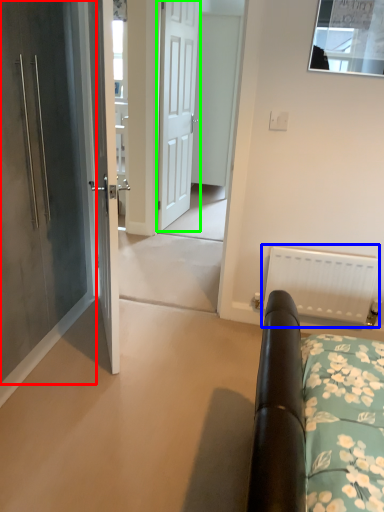
Question: Which object is positioned closest to door (highlighted by a red box)? Select from radiator (highlighted by a blue box) and door (highlighted by a green box).

Choices:
 (A) radiator
 (B) door

Answer: (A)